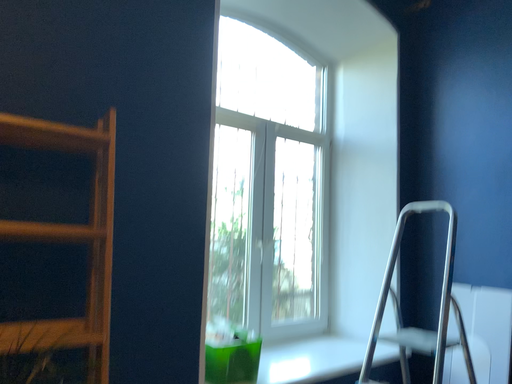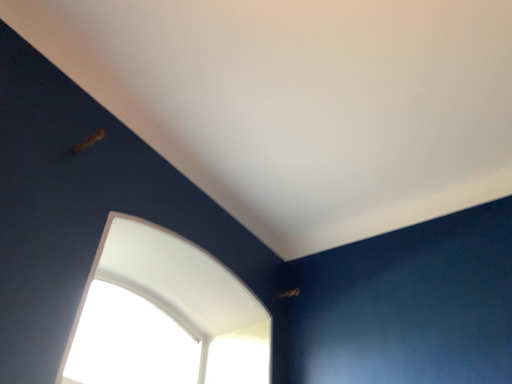
Question: Which way did the camera rotate in the video?

Choices:
 (A) rotated right
 (B) rotated left

Answer: (A)